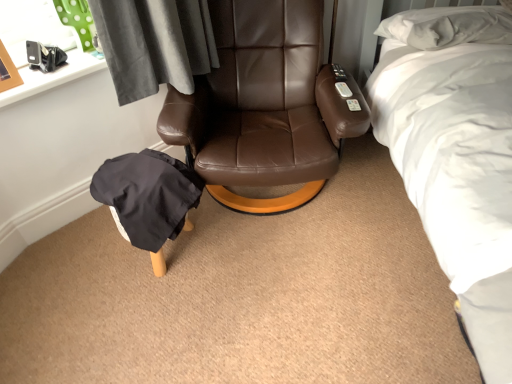
Question: In the image, is brown leather chair at center positioned in front of or behind white soft bed at upper right?

Choices:
 (A) front
 (B) behind

Answer: (B)

Question: Considering the positions of point (266, 24) and point (435, 167), is point (266, 24) closer or farther from the camera than point (435, 167)?

Choices:
 (A) farther
 (B) closer

Answer: (A)

Question: Estimate the real-world distances between objects in this image. Which object is closer to the black fabric bean bag chair at lower left?

Choices:
 (A) white soft bed at upper right
 (B) brown leather chair at center

Answer: (B)

Question: Based on their relative distances, which object is farther from the white soft bed at upper right?

Choices:
 (A) brown leather chair at center
 (B) black fabric bean bag chair at lower left

Answer: (B)